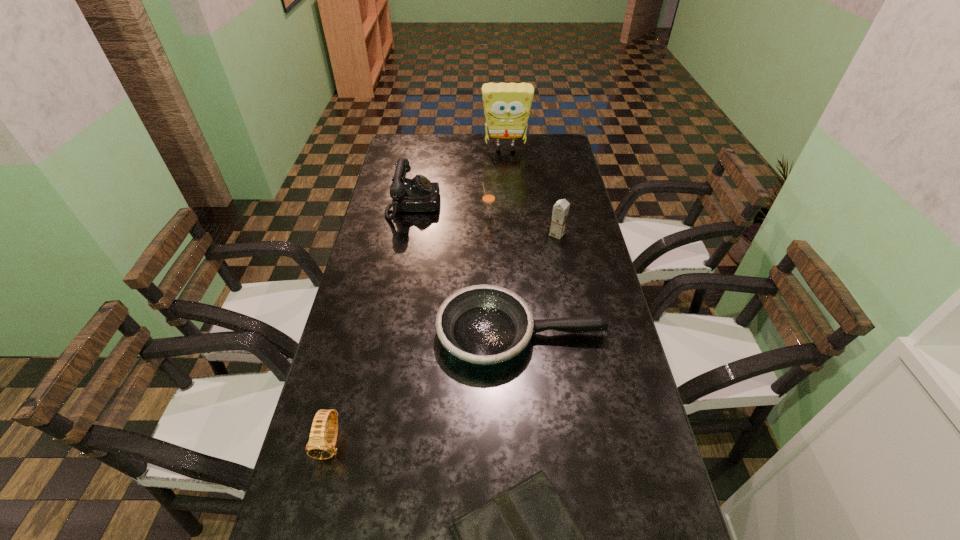
Locate an element on the screen. The height and width of the screenshot is (540, 960). object that can be found as the third closest to the fourth nearest object is located at coordinates (418, 194).

Find the location of a particular element. Image resolution: width=960 pixels, height=540 pixels. vacant area in the image that satisfies the following two spatial constraints: 1. on the back side of the straw; 2. on the dial of the telephone is located at coordinates (488, 205).

Find the location of a particular element. This screenshot has height=540, width=960. blank area in the image that satisfies the following two spatial constraints: 1. on the back side of the chocolate milk; 2. on the dial of the telephone is located at coordinates (551, 205).

Identify the location of vacant space that satisfies the following two spatial constraints: 1. on the dial of the telephone; 2. on the right side of the chocolate milk. The image size is (960, 540). (408, 234).

Where is `vacant space that satisfies the following two spatial constraints: 1. on the face of the sponge; 2. on the dial of the telephone`? The width and height of the screenshot is (960, 540). vacant space that satisfies the following two spatial constraints: 1. on the face of the sponge; 2. on the dial of the telephone is located at coordinates (510, 205).